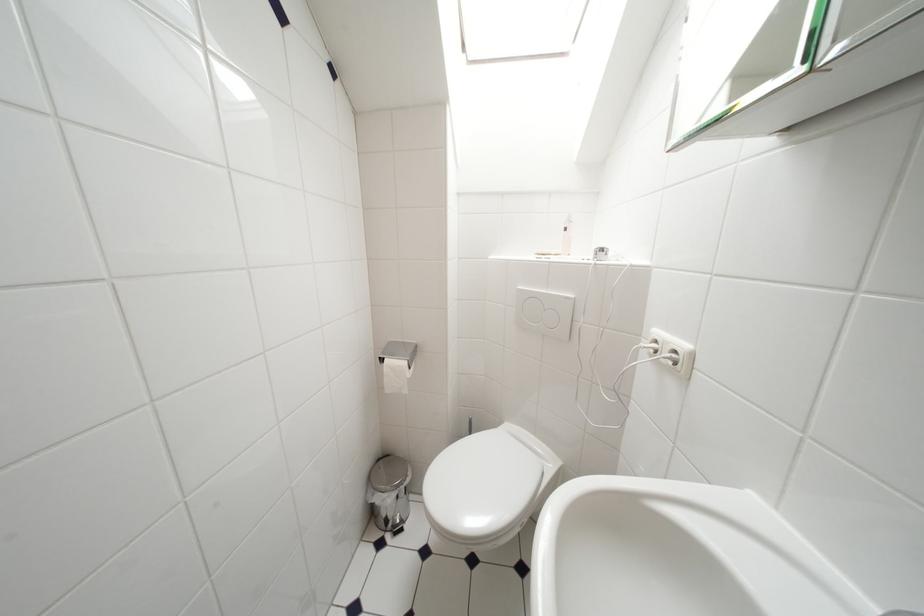
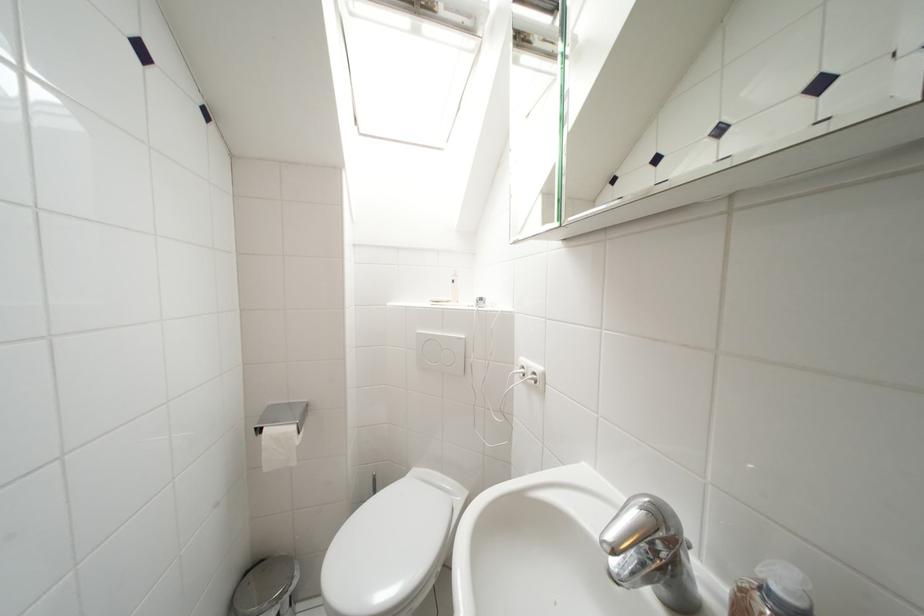
Find the pixel in the second image that matches [385,463] in the first image.

(253, 577)